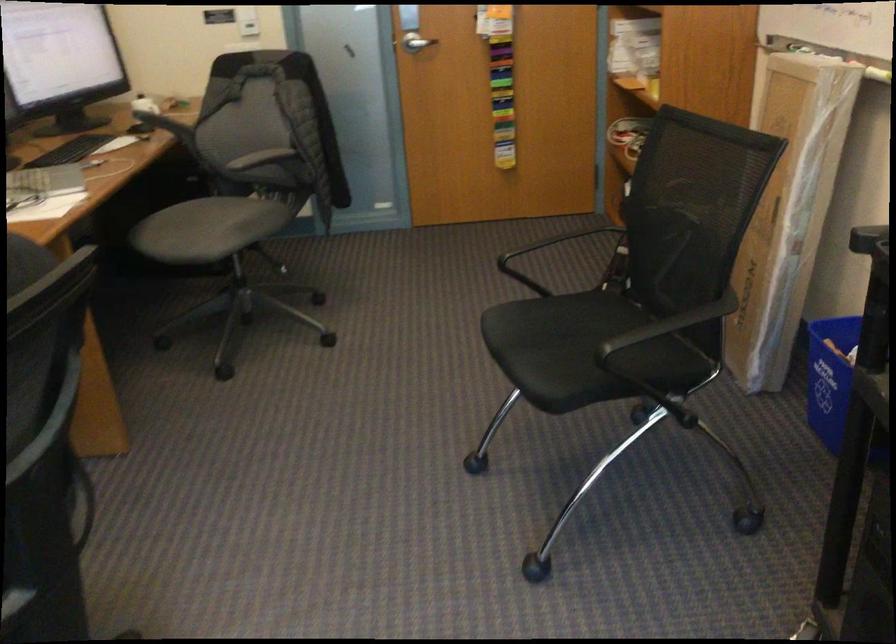
At what (x,y) coordinates should I click in order to perform the action: click on cardboard box. Please return your answer as a coordinate pair (x, y). This screenshot has width=896, height=644. Looking at the image, I should click on (788, 212).